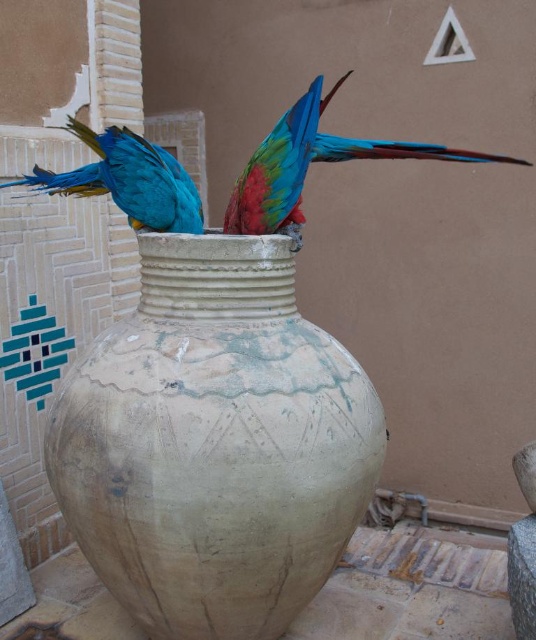
Question: Is shiny blue parrot at upper center wider than blue glossy parrot at upper center?

Choices:
 (A) yes
 (B) no

Answer: (A)

Question: In this image, where is earthy clay vase at center located relative to blue glossy parrot at upper center?

Choices:
 (A) above
 (B) below

Answer: (B)

Question: Estimate the real-world distances between objects in this image. Which object is closer to the blue glossy parrot at upper center?

Choices:
 (A) earthy clay vase at center
 (B) shiny blue parrot at upper center

Answer: (B)

Question: Where is shiny blue parrot at upper center located in relation to blue glossy parrot at upper center in the image?

Choices:
 (A) right
 (B) left

Answer: (A)

Question: Which point appears closest to the camera in this image?

Choices:
 (A) (294, 220)
 (B) (68, 394)
 (C) (138, 211)

Answer: (B)

Question: Estimate the real-world distances between objects in this image. Which object is farther from the shiny blue parrot at upper center?

Choices:
 (A) earthy clay vase at center
 (B) blue glossy parrot at upper center

Answer: (A)